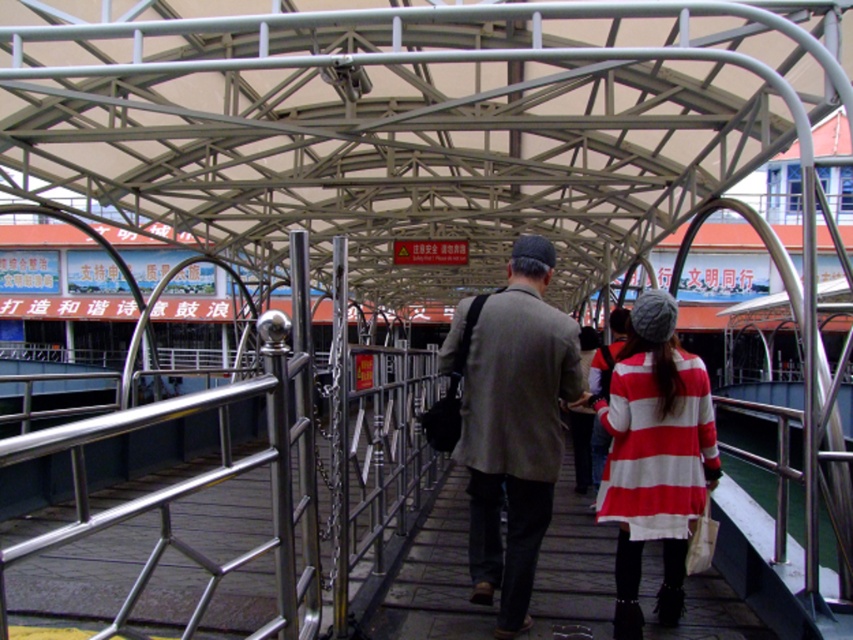
You are standing on the covered pedestrian bridge and want to take a photo of two specific points on the bridge. The first point is at coordinates point (468, 586) and the second is at point (624, 442). Which point is closer to your camera when you take the photo?

Point (468, 586) is closer to the camera than point (624, 442) because it is further to the camera than the other point.

You are a photographer standing on the covered pedestrian bridge and want to take a photo of both the gray woolen jacket at center and the striped woolen coat at center in the same frame. The minimum distance between the two people to fit in your camera lens is 24 inches. Will you be able to capture both in one shot?

The gray woolen jacket at center and striped woolen coat at center are 23.58 inches apart from each other, which is less than the required 24 inches. Therefore, you can capture both in one shot as they are within the camera lens range.

You are standing on the covered pedestrian bridge and see the white striped dress at center. If you want to reach the dress quickly, which direction should you walk towards?

Since the white striped dress at center is located at point (428, 579) in 2D coordinates, you should walk towards the center of the bridge to reach it quickly.